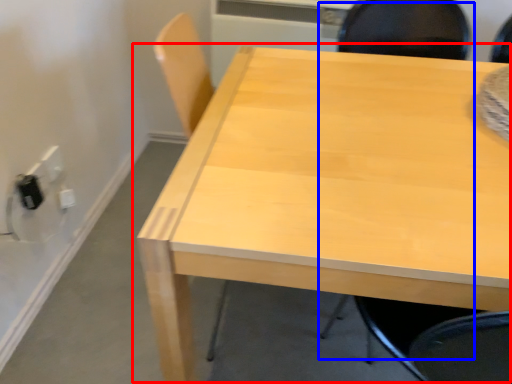
Question: Which of the following is the farthest to the observer, table (highlighted by a red box) or chair (highlighted by a blue box)?

Choices:
 (A) table
 (B) chair

Answer: (A)